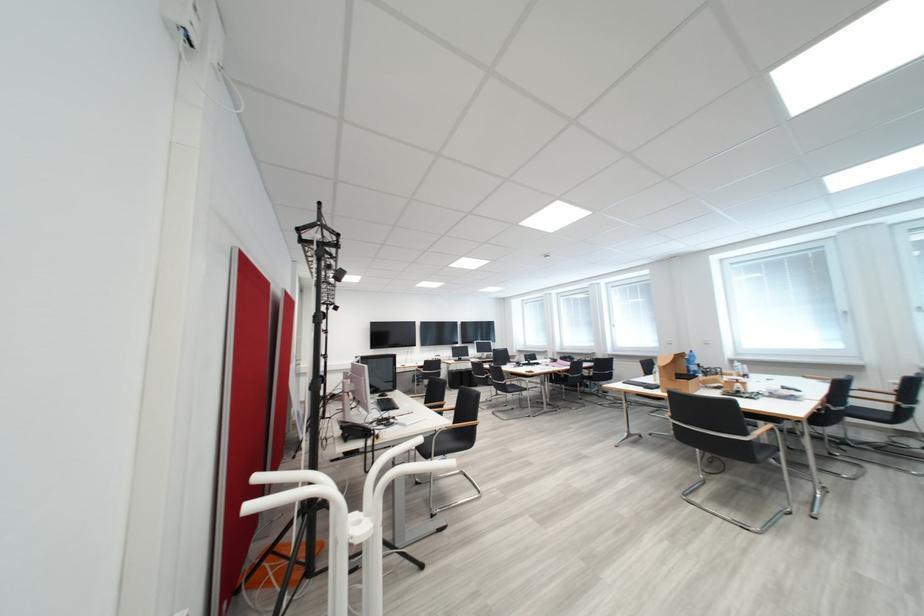
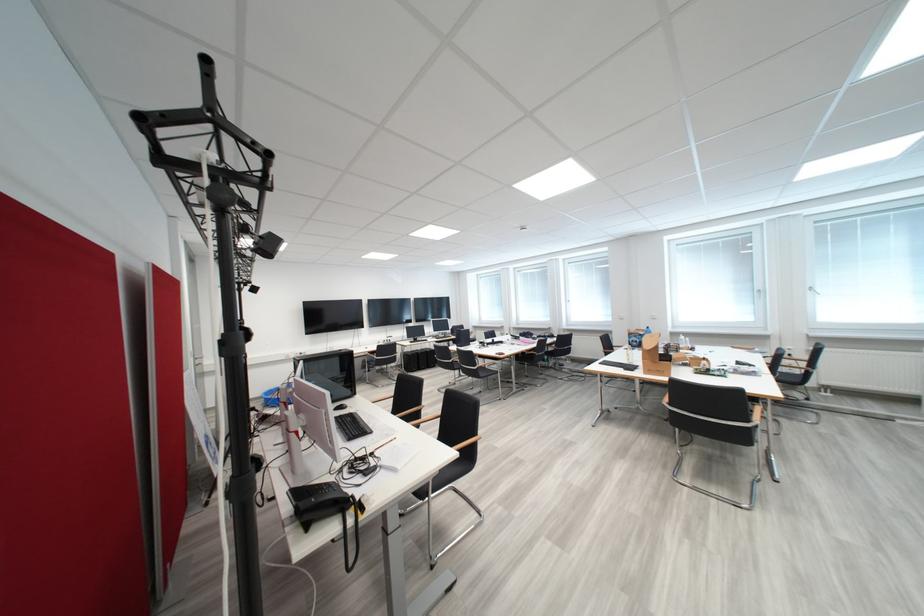
Where in the second image is the point corresponding to (362,432) from the first image?

(325, 507)